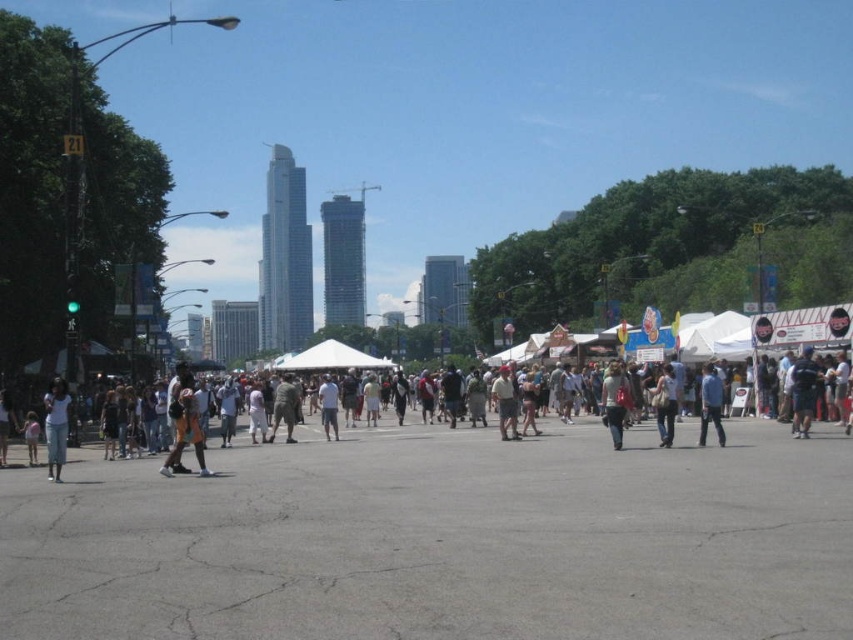
Does light brown fabric bag at center have a smaller size compared to light brown leather jacket at center?

Yes, light brown fabric bag at center is smaller than light brown leather jacket at center.

Does light brown fabric bag at center appear on the right side of light brown leather jacket at center?

Correct, you'll find light brown fabric bag at center to the right of light brown leather jacket at center.

Describe the element at coordinates (665, 404) in the screenshot. I see `light brown fabric bag at center` at that location.

The image size is (853, 640). I want to click on light brown fabric bag at center, so click(x=665, y=404).

Between dark gray shorts at center and dark blue jeans at center, which one has more height?

dark blue jeans at center is taller.

Which of these two, dark gray shorts at center or dark blue jeans at center, stands shorter?

dark gray shorts at center

At what (x,y) coordinates should I click in order to perform the action: click on dark gray shorts at center. Please return your answer as a coordinate pair (x, y). Looking at the image, I should click on (422, 440).

At what (x,y) coordinates should I click in order to perform the action: click on dark gray shorts at center. Please return your answer as a coordinate pair (x, y). Image resolution: width=853 pixels, height=640 pixels. Looking at the image, I should click on point(422,440).

Can you confirm if light brown leather jacket at center is smaller than white cotton shirt at center?

Yes.

Who is lower down, light brown leather jacket at center or white cotton shirt at center?

white cotton shirt at center is lower down.

Is point (508, 403) positioned before point (321, 401)?

Yes, point (508, 403) is in front of point (321, 401).

Locate an element on the screen. This screenshot has width=853, height=640. light brown leather jacket at center is located at coordinates (505, 403).